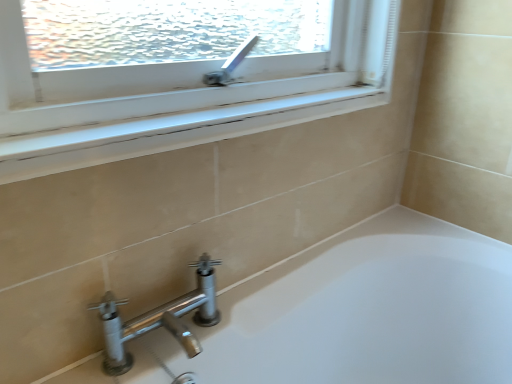
I want to click on polished chrome faucet at lower center, so click(x=159, y=319).

This screenshot has width=512, height=384. What do you see at coordinates (159, 319) in the screenshot? I see `polished chrome faucet at lower center` at bounding box center [159, 319].

Locate an element on the screen. This screenshot has width=512, height=384. polished chrome faucet at lower center is located at coordinates (159, 319).